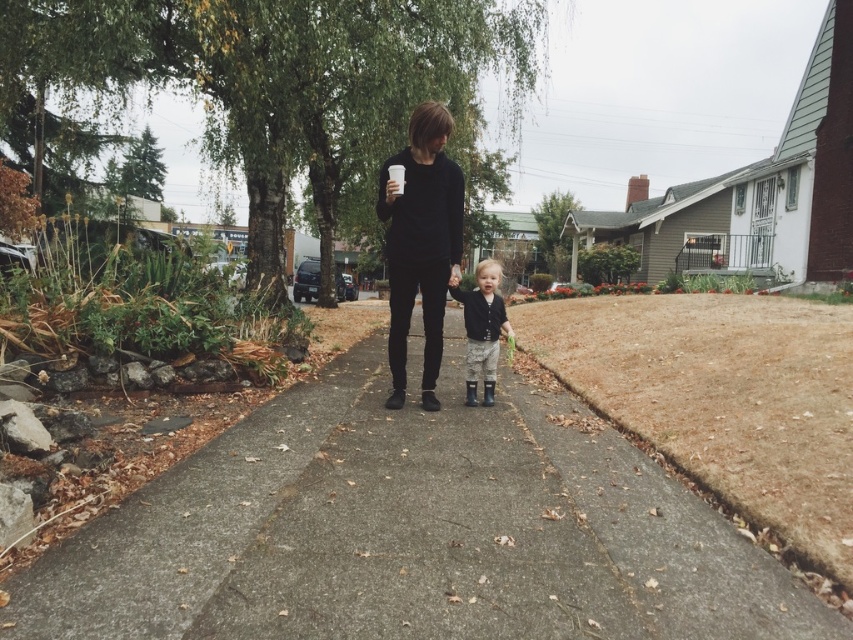
Which is behind, point (695, 563) or point (483, 284)?

Point (483, 284)

Between concrete at center and matte black jacket at center, which one is positioned lower?

concrete at center is lower down.

Is point (236, 531) closer to viewer compared to point (480, 346)?

That is True.

Where is `concrete at center`? The image size is (853, 640). concrete at center is located at coordinates (413, 531).

Who is shorter, concrete at center or black matte/black pants at center?

concrete at center

Is concrete at center above black matte/black pants at center?

No, concrete at center is not above black matte/black pants at center.

Which is in front, point (618, 609) or point (403, 276)?

Point (618, 609)

Where is `concrete at center`? This screenshot has width=853, height=640. concrete at center is located at coordinates (413, 531).

Is black matte/black pants at center above matte black jacket at center?

Yes, black matte/black pants at center is above matte black jacket at center.

Based on the photo, is black matte/black pants at center taller than matte black jacket at center?

Indeed, black matte/black pants at center has a greater height compared to matte black jacket at center.

The image size is (853, 640). What do you see at coordinates (421, 243) in the screenshot?
I see `black matte/black pants at center` at bounding box center [421, 243].

Locate an element on the screen. This screenshot has width=853, height=640. black matte/black pants at center is located at coordinates (421, 243).